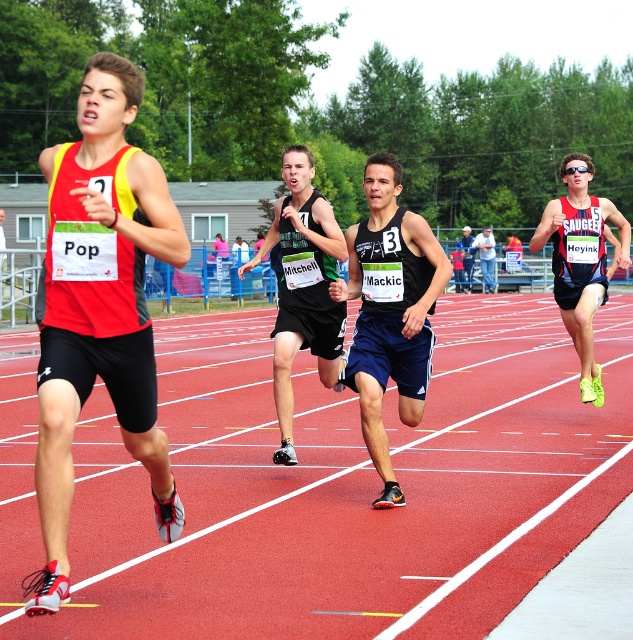
You are a spectator at the track and field event. You notice two items of clothing worn by the third runner from the left. The items are the black matte shorts at center and the matte black tank top at center. Which item is positioned lower on the runner?

The black matte shorts at center is located below matte black tank top at center, so the black matte shorts at center is positioned lower on the runner.

Which athlete is wearing the black matte tank top at center?

The third runner from the left is wearing the black matte tank top at center.

You are a photographer positioned at the finish line of the sprint race. You want to capture a photo that includes both the denim jacket at center and the matte black tank top at center. Which athlete should you focus on to ensure both are in the frame?

The denim jacket at center has a lesser width compared to matte black tank top at center, so focusing on the matte black tank top at center would ensure both are in the frame since it is wider and likely closer to the center.